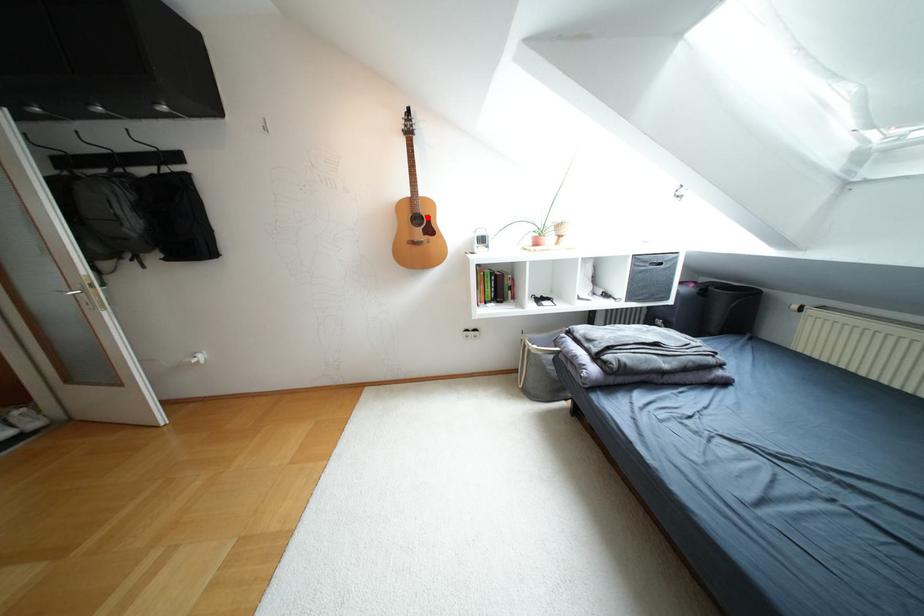
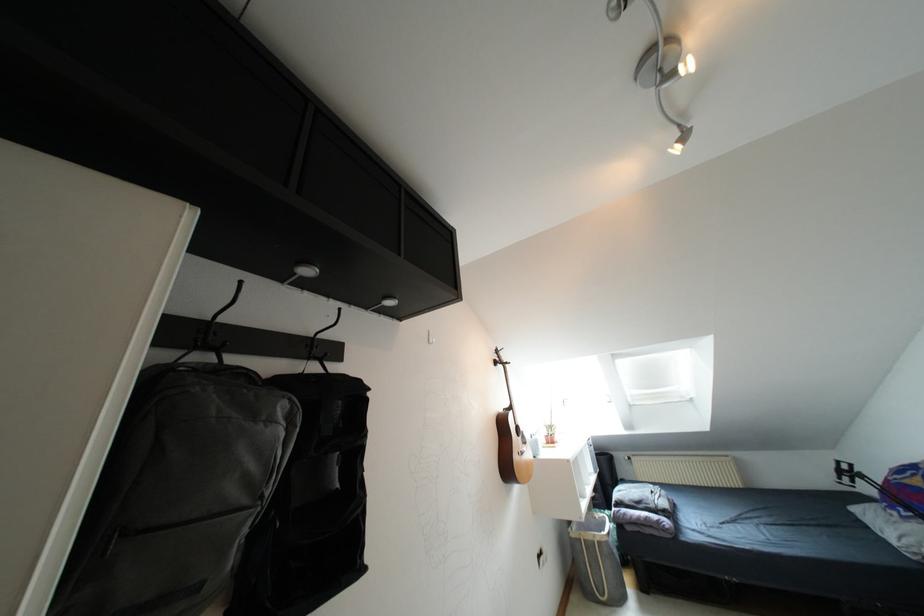
Question: I am providing you with two images of the same scene from different viewpoints. A red point is marked on the first image. At the location where the point appears in image 1, is it still visible in image 2?

Choices:
 (A) Yes
 (B) No

Answer: (B)